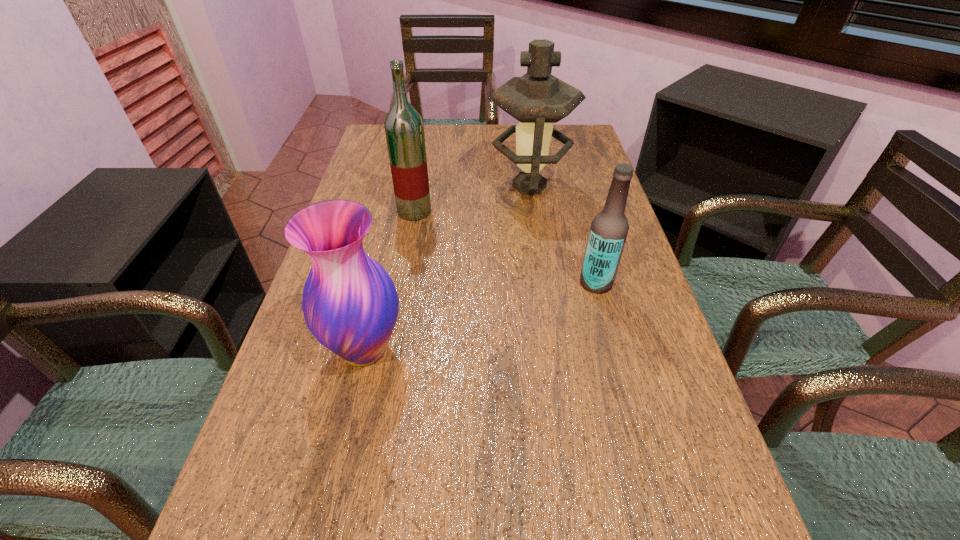
Locate an element on the screen. The image size is (960, 540). oil lamp is located at coordinates (537, 99).

At what (x,y) coordinates should I click in order to perform the action: click on liquor. Please return your answer as a coordinate pair (x, y). This screenshot has height=540, width=960. Looking at the image, I should click on (404, 129).

The width and height of the screenshot is (960, 540). I want to click on the nearest object, so click(350, 304).

Where is `the second nearest object`? Image resolution: width=960 pixels, height=540 pixels. the second nearest object is located at coordinates (609, 229).

Identify the location of vacant region located 0.320m on the left of the oil lamp. (378, 186).

Find the location of a particular element. Image resolution: width=960 pixels, height=540 pixels. vacant space located 0.290m on the front of the liquor is located at coordinates tap(398, 301).

I want to click on vacant space located on the right of the vase, so click(512, 349).

Find the location of a particular element. vacant region located 0.290m on the label of the second nearest object is located at coordinates (453, 283).

Where is `free space located on the label of the second nearest object`? free space located on the label of the second nearest object is located at coordinates (453, 283).

Identify the location of vacant space located on the label of the second nearest object. The width and height of the screenshot is (960, 540). (436, 283).